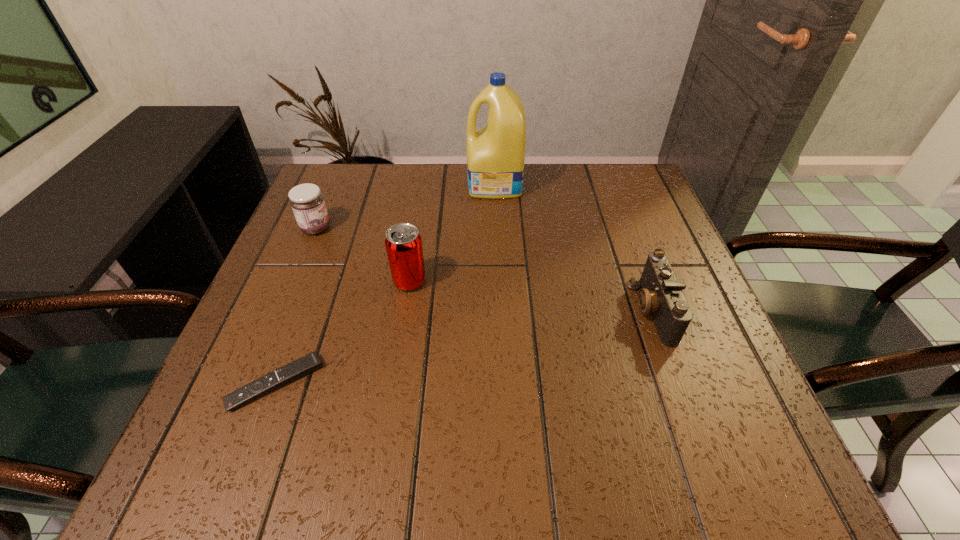
Where is `empty space that is in between the fourth shortest object and the fourth object from left to right`? The height and width of the screenshot is (540, 960). empty space that is in between the fourth shortest object and the fourth object from left to right is located at coordinates (452, 233).

The image size is (960, 540). What are the coordinates of `free space between the third object from left to right and the detergent` in the screenshot? It's located at (452, 233).

Where is `empty location between the shortest object and the jam`? empty location between the shortest object and the jam is located at coordinates (296, 306).

What are the coordinates of `vacant area that lies between the camera and the third object from right to left` in the screenshot? It's located at (531, 295).

The image size is (960, 540). Identify the location of empty location between the third object from left to right and the rightmost object. (531, 295).

Find the location of `free space between the fourth object from left to right and the nearest object`. free space between the fourth object from left to right and the nearest object is located at coordinates (385, 284).

What are the coordinates of `free space between the tallest object and the fourth shortest object` in the screenshot? It's located at (452, 233).

The height and width of the screenshot is (540, 960). In order to click on free point between the shortest object and the second farthest object in this screenshot , I will do `click(296, 306)`.

Locate which object is the second closest to the soda can. Please provide its 2D coordinates. Your answer should be formatted as a tuple, i.e. [(x, y)], where the tuple contains the x and y coordinates of a point satisfying the conditions above.

[(306, 201)]

This screenshot has width=960, height=540. I want to click on object that is the closest to the farthest object, so click(x=403, y=243).